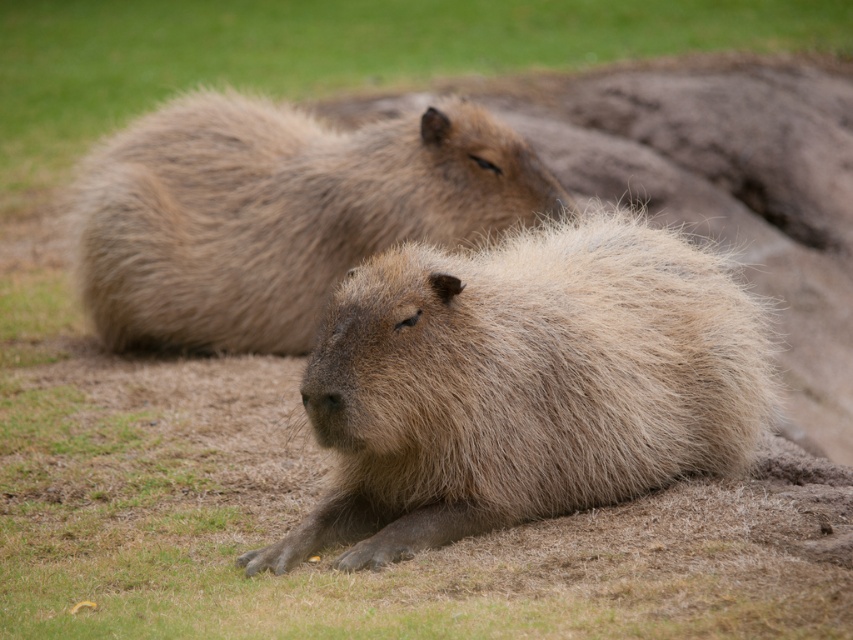
You are standing at the origin point of a coordinate system where the bottom left corner of the image is the origin. You want to locate the brown fuzzy capybara at center. What are its coordinates?

The coordinates of the brown fuzzy capybara at center are at point (523, 385).

You are a wildlife photographer aiming to capture both brown fuzzy capybara at center and brown fuzzy capybara at upper center in a single frame. Based on their positions, which capybara would appear smaller in your photo?

The brown fuzzy capybara at center would appear smaller in the photo because it has a lesser width compared to the brown fuzzy capybara at upper center.

You are a wildlife photographer trying to capture both capybaras in a single photo. The camera you have can only focus on objects within a 1.2 meter height range. Given their sizes, will both brown fuzzy capybara at center and brown fuzzy capybara at upper center fit into the camera focus range?

The brown fuzzy capybara at center is smaller than the brown fuzzy capybara at upper center. Since the camera can focus on objects within a 1.2 meter height range, and the size difference between them is within that range, both capybaras will fit into the camera focus range.